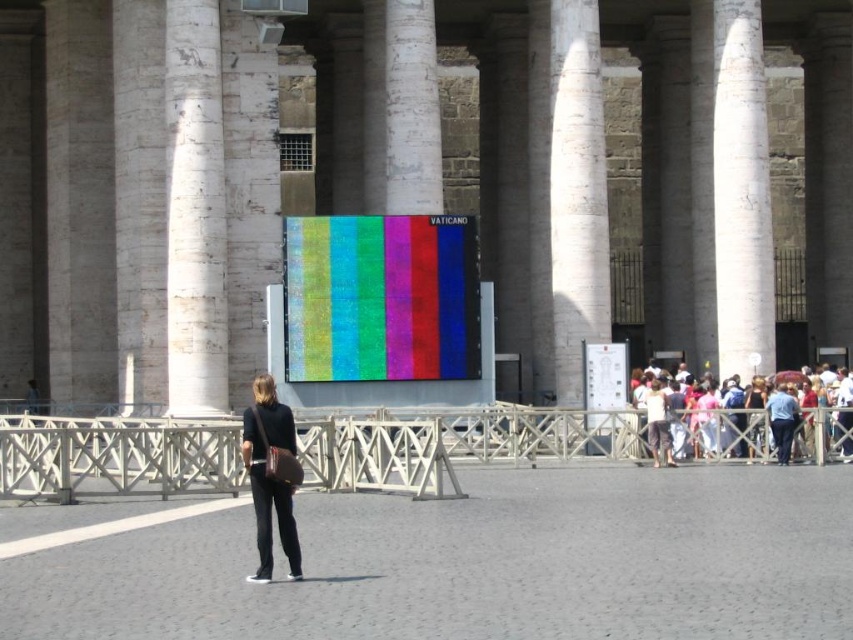
You are a tourist standing in front of the classical building. You notice the white marble pillar at left and the multicolored fabric crowd at right. Which object is wider?

The multicolored fabric crowd at right is wider than the white marble pillar at left.

You are standing in front of the classical structure and want to take a photo that includes both the white marble pillar at left and the multicolored fabric crowd at right. Based on their positions, which object should you position closer to the bottom of your camera frame?

The multicolored fabric crowd at right should be positioned closer to the bottom of the camera frame because the white marble pillar at left is located above it.